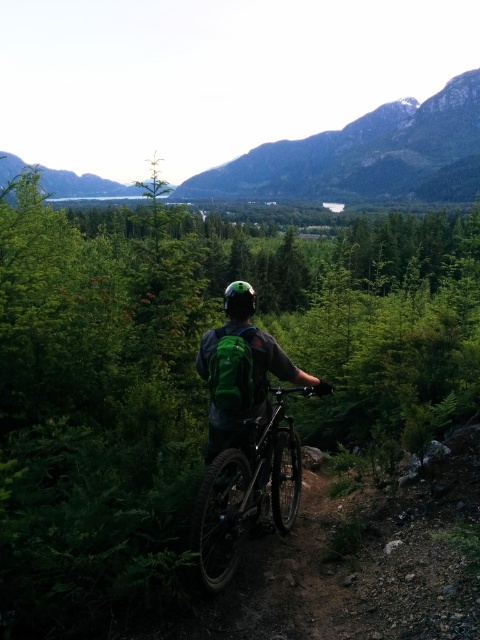
Question: Which of these objects is positioned farthest from the green matte forest at center?

Choices:
 (A) shiny metallic bicycle at center
 (B) green matte backpack at center

Answer: (B)

Question: Which object is positioned farthest from the green matte backpack at center?

Choices:
 (A) shiny metallic bicycle at center
 (B) green matte forest at center

Answer: (B)

Question: Which object is closer to the camera taking this photo?

Choices:
 (A) green matte backpack at center
 (B) shiny metallic bicycle at center
 (C) green matte forest at center

Answer: (C)

Question: Is green matte forest at center further to the viewer compared to green matte backpack at center?

Choices:
 (A) no
 (B) yes

Answer: (A)

Question: Is green matte forest at center to the left of shiny metallic bicycle at center from the viewer's perspective?

Choices:
 (A) yes
 (B) no

Answer: (B)

Question: Is green matte forest at center to the right of shiny metallic bicycle at center from the viewer's perspective?

Choices:
 (A) no
 (B) yes

Answer: (B)